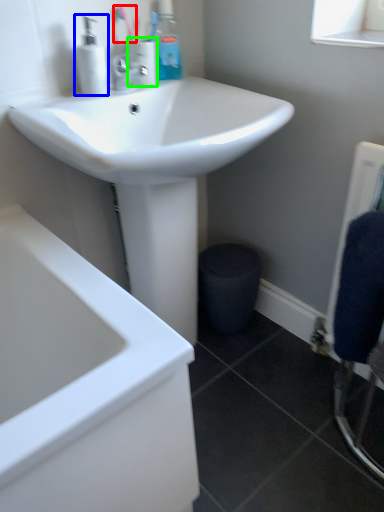
Question: Which object is the farthest from toothbrush (highlighted by a red box)? Choose among these: soap dispenser (highlighted by a blue box) or toiletry (highlighted by a green box).

Choices:
 (A) soap dispenser
 (B) toiletry

Answer: (A)